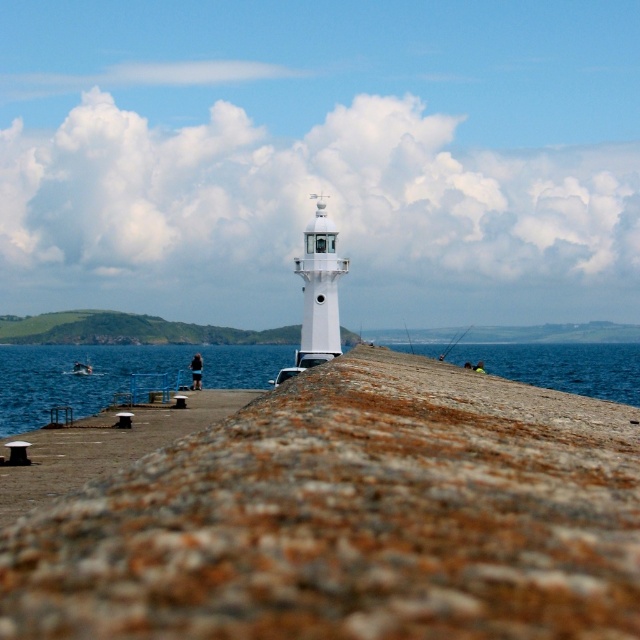
Which of these two, blue water at lower right or white plastic boat at center, stands shorter?

Standing shorter between the two is white plastic boat at center.

Is point (556, 362) positioned after point (92, 369)?

Yes, it is behind point (92, 369).

Identify the location of blue water at lower right. The height and width of the screenshot is (640, 640). (561, 365).

This screenshot has width=640, height=640. What do you see at coordinates (352, 518) in the screenshot?
I see `rusty concrete pier at center` at bounding box center [352, 518].

Can you confirm if rusty concrete pier at center is wider than blue water at lower right?

Incorrect, rusty concrete pier at center's width does not surpass blue water at lower right's.

Is point (250, 612) closer to viewer compared to point (618, 380)?

Yes, point (250, 612) is in front of point (618, 380).

The height and width of the screenshot is (640, 640). I want to click on rusty concrete pier at center, so click(352, 518).

From the picture: Can you confirm if rusty concrete pier at center is thinner than white plastic boat at center?

Yes.

How much distance is there between rusty concrete pier at center and white plastic boat at center?

657.33 feet

Is point (278, 474) positioned after point (77, 369)?

No, it is in front of (77, 369).

Image resolution: width=640 pixels, height=640 pixels. What are the coordinates of `rusty concrete pier at center` in the screenshot? It's located at (352, 518).